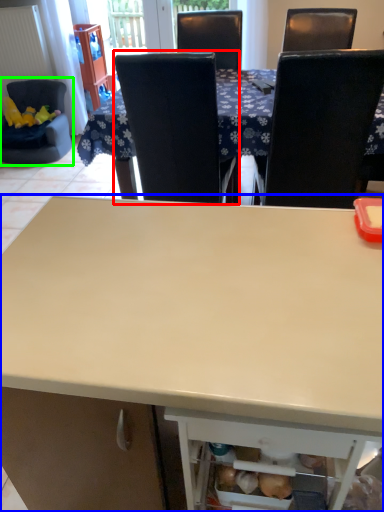
Question: Estimate the real-world distances between objects in this image. Which object is closer to chair (highlighted by a red box), desk (highlighted by a blue box) or chair (highlighted by a green box)?

Choices:
 (A) desk
 (B) chair

Answer: (A)